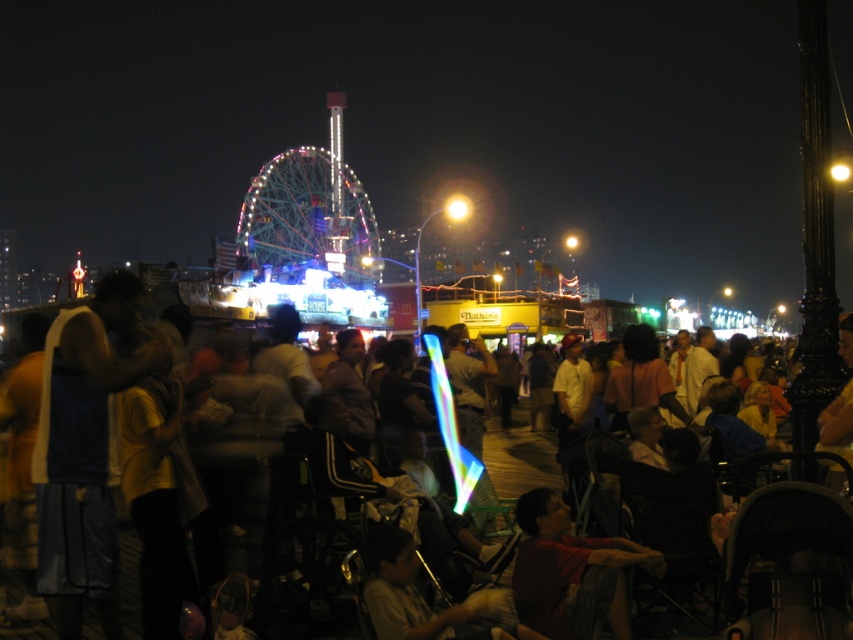
Question: Is multicolored metallic ferris wheel at center closer to camera compared to red shirt at lower right?

Choices:
 (A) no
 (B) yes

Answer: (A)

Question: Does multicolored metallic ferris wheel at center lie in front of red shirt at lower right?

Choices:
 (A) no
 (B) yes

Answer: (A)

Question: Which point appears farthest from the camera in this image?

Choices:
 (A) (258, 209)
 (B) (543, 488)

Answer: (A)

Question: Can you confirm if multicolored metallic ferris wheel at center is positioned to the right of red shirt at lower right?

Choices:
 (A) yes
 (B) no

Answer: (B)

Question: Which point is closer to the camera?

Choices:
 (A) (273, 168)
 (B) (648, 554)

Answer: (B)